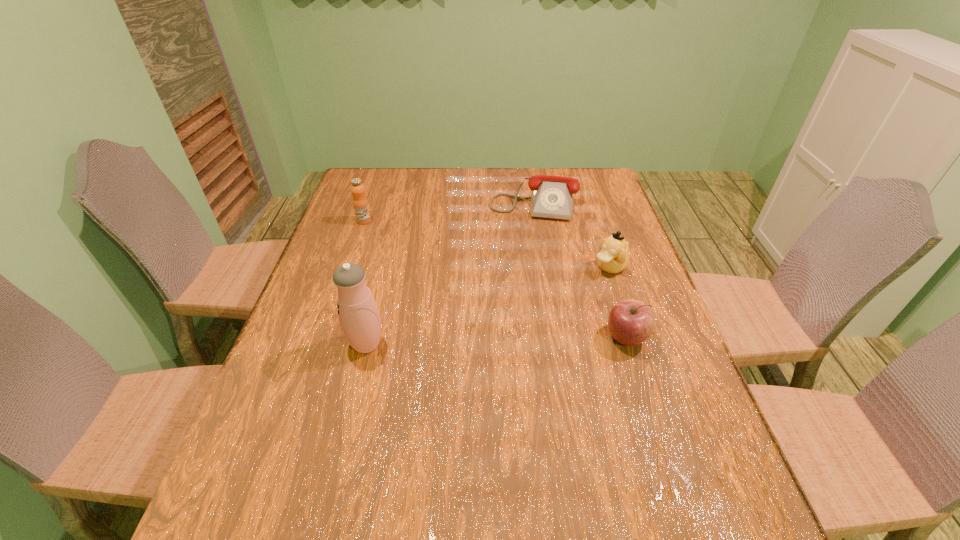
You are a GUI agent. You are given a task and a screenshot of the screen. Output one action in this format:
    pyautogui.click(x=<x>, y=<y>)
    Task: Click on the second object from left to right
    
    Given the screenshot: What is the action you would take?
    pyautogui.click(x=358, y=314)

Find the location of a particular element. The image size is (960, 540). the tallest object is located at coordinates (358, 314).

This screenshot has height=540, width=960. I want to click on apple, so click(x=631, y=322).

Locate an element on the screen. duckling is located at coordinates (613, 257).

Where is `the shortest object`? This screenshot has height=540, width=960. the shortest object is located at coordinates pyautogui.click(x=552, y=197).

The width and height of the screenshot is (960, 540). Find the location of `the leftmost object`. the leftmost object is located at coordinates (360, 202).

This screenshot has height=540, width=960. In order to click on the second tallest object in this screenshot , I will do `click(360, 202)`.

The height and width of the screenshot is (540, 960). What are the coordinates of `free space located 0.260m on the front of the thermos bottle` in the screenshot? It's located at (335, 471).

This screenshot has height=540, width=960. Find the location of `vacant space located 0.310m on the left of the apple`. vacant space located 0.310m on the left of the apple is located at coordinates (475, 338).

This screenshot has height=540, width=960. In order to click on vacant space located on the face of the duckling in this screenshot , I will do pyautogui.click(x=491, y=343).